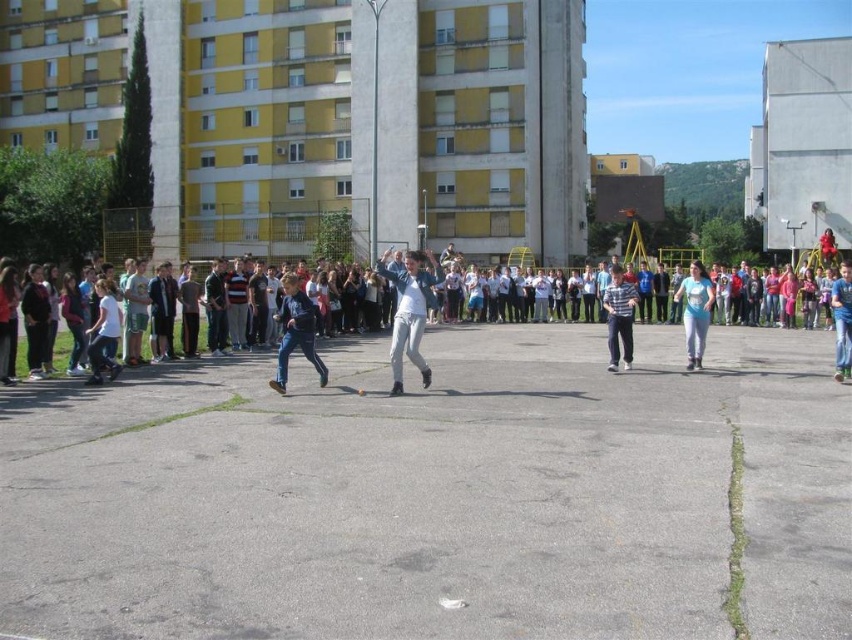
Can you confirm if light blue jeans at center is positioned above light blue denim jeans at center?

Yes.

Between light blue jeans at center and light blue denim jeans at center, which one is positioned higher?

Positioned higher is light blue jeans at center.

Describe the element at coordinates (185, 310) in the screenshot. The width and height of the screenshot is (852, 640). I see `light blue jeans at center` at that location.

At what (x,y) coordinates should I click in order to perform the action: click on light blue jeans at center. Please return your answer as a coordinate pair (x, y). The height and width of the screenshot is (640, 852). Looking at the image, I should click on (185, 310).

Can you confirm if light blue jeans at center is positioned to the right of dark blue jeans at center?

In fact, light blue jeans at center is to the left of dark blue jeans at center.

Does point (476, 275) come closer to viewer compared to point (303, 291)?

No, it is behind (303, 291).

Between point (256, 308) and point (291, 328), which one is positioned in front?

Point (291, 328) is in front.

In order to click on light blue jeans at center in this screenshot , I will do `click(185, 310)`.

Does light gray fabric pants at center appear over light blue denim jeans at center?

Correct, light gray fabric pants at center is located above light blue denim jeans at center.

Does light gray fabric pants at center have a greater height compared to light blue denim jeans at center?

Yes.

Is point (403, 296) more distant than point (703, 284)?

No, (403, 296) is in front of (703, 284).

Image resolution: width=852 pixels, height=640 pixels. I want to click on light gray fabric pants at center, so click(409, 316).